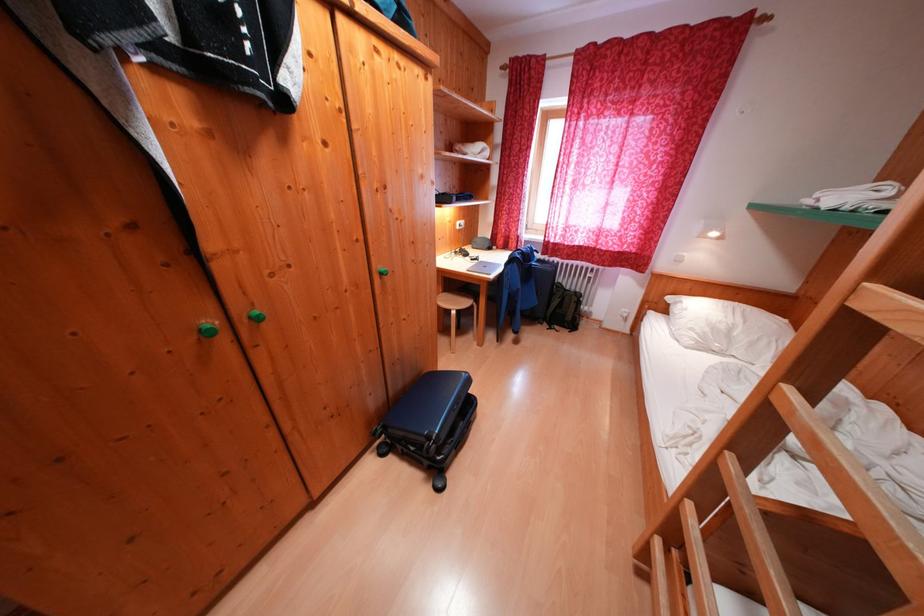
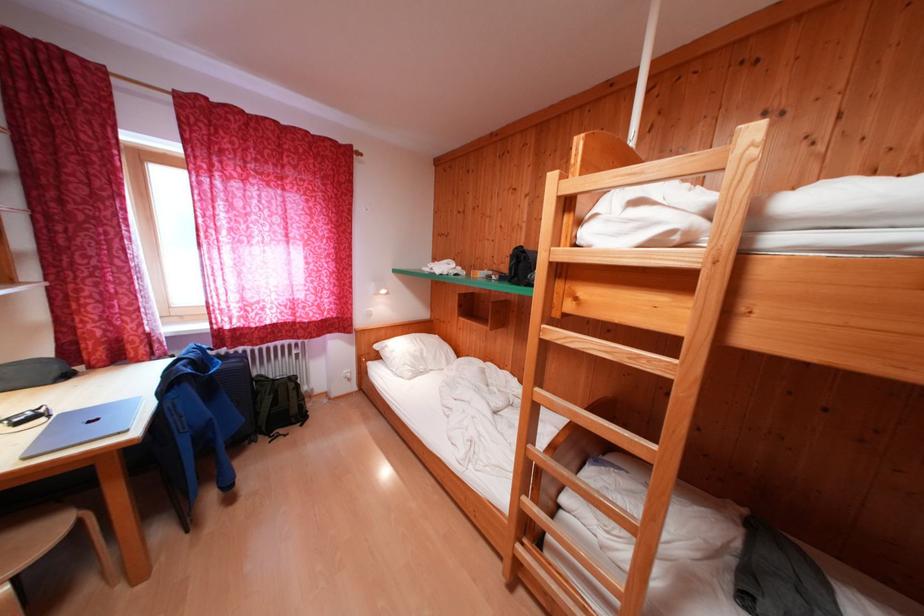
Locate, in the second image, the point that corresponds to point (568, 291) in the first image.

(271, 383)